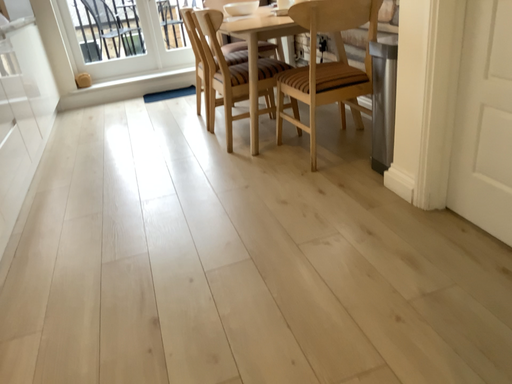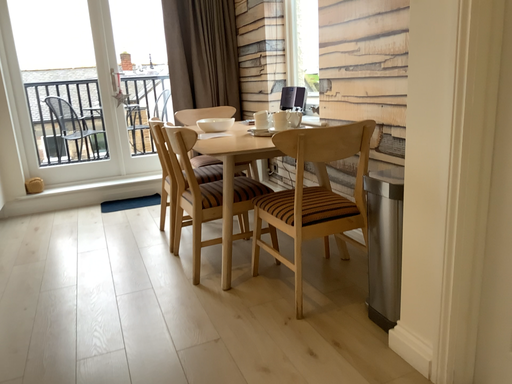
Question: Which way did the camera rotate in the video?

Choices:
 (A) rotated downward
 (B) rotated upward

Answer: (B)